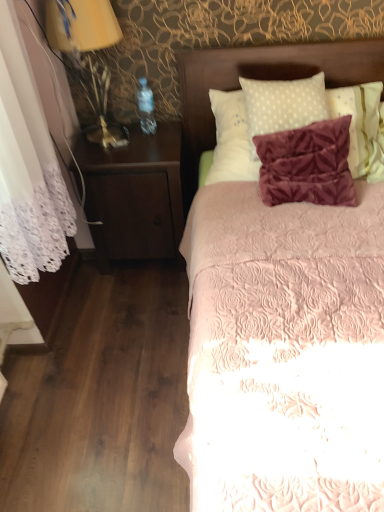
Question: From their relative heights in the image, would you say matte gold lamp at left is taller or shorter than velvet brown headboard at upper center?

Choices:
 (A) short
 (B) tall

Answer: (B)

Question: Is point (114, 137) closer or farther from the camera than point (193, 133)?

Choices:
 (A) farther
 (B) closer

Answer: (B)

Question: Which object is the farthest from the dark wood nightstand at left?

Choices:
 (A) matte gold lamp at left
 (B) velvet brown headboard at upper center
 (C) pink quilted bed at center

Answer: (B)

Question: Based on their relative distances, which object is farther from the dark wood nightstand at left?

Choices:
 (A) velvet brown headboard at upper center
 (B) matte gold lamp at left
 (C) pink quilted bed at center

Answer: (A)